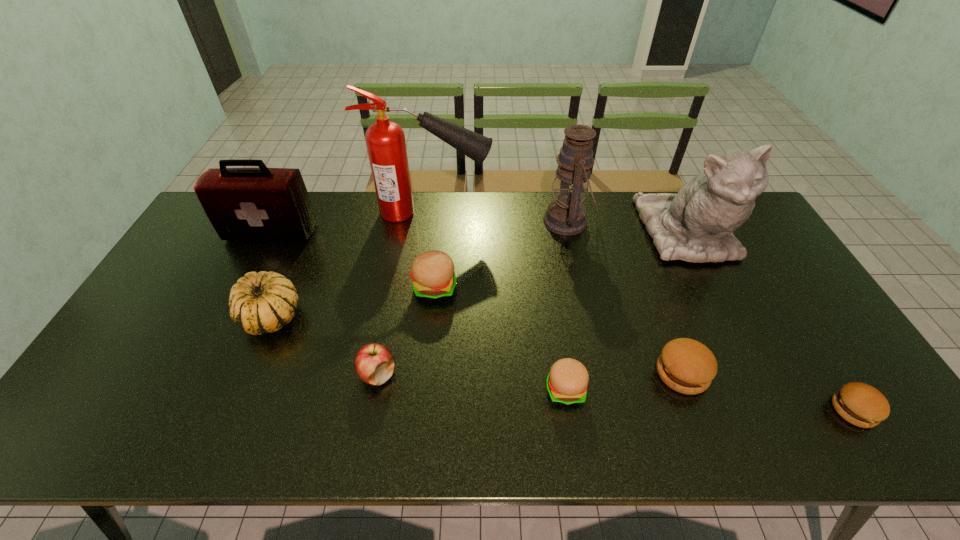
Where is `object located at the near edge`? This screenshot has height=540, width=960. object located at the near edge is located at coordinates (860, 404).

Locate an element on the screen. This screenshot has height=540, width=960. object situated at the left edge is located at coordinates (243, 204).

Find the location of `cat located at the right edge`. cat located at the right edge is located at coordinates (696, 224).

At what (x,y) coordinates should I click in order to perform the action: click on hamburger present at the right edge. Please return your answer as a coordinate pair (x, y). This screenshot has height=540, width=960. Looking at the image, I should click on (860, 404).

Where is `object positioned at the far left corner`? This screenshot has height=540, width=960. object positioned at the far left corner is located at coordinates (243, 204).

Image resolution: width=960 pixels, height=540 pixels. I want to click on object that is at the far right corner, so pyautogui.click(x=696, y=224).

Locate an element on the screen. Image resolution: width=960 pixels, height=540 pixels. object that is at the near right corner is located at coordinates (860, 404).

Find the location of a particular element. vacant space at the far edge is located at coordinates (482, 195).

Identify the location of free spot at the near edge of the desktop. Image resolution: width=960 pixels, height=540 pixels. (527, 436).

This screenshot has height=540, width=960. I want to click on vacant space at the right edge of the desktop, so click(846, 374).